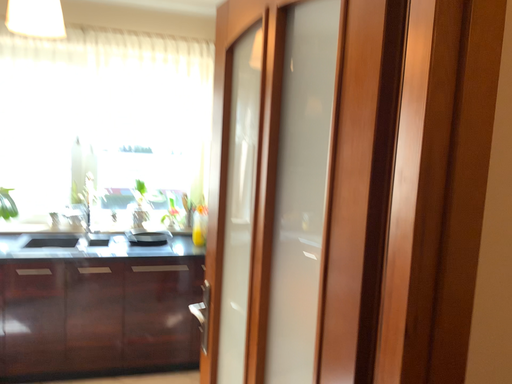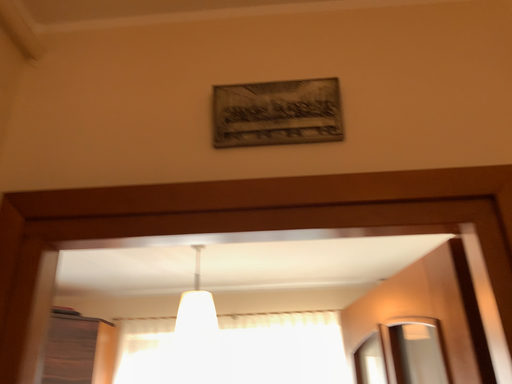
Question: Which way did the camera rotate in the video?

Choices:
 (A) rotated downward
 (B) rotated upward

Answer: (B)